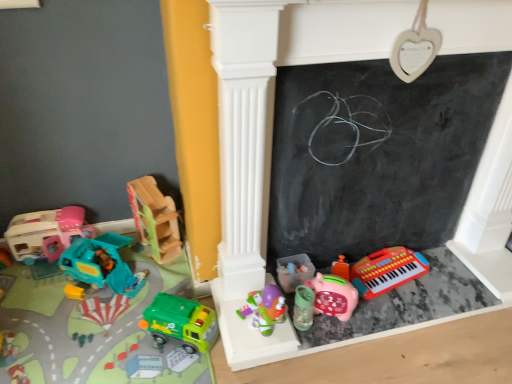
Where is `vacant space to the right of teal plastic truck at left, the 6th toy in the right-to-left sequence`? The image size is (512, 384). vacant space to the right of teal plastic truck at left, the 6th toy in the right-to-left sequence is located at coordinates (144, 291).